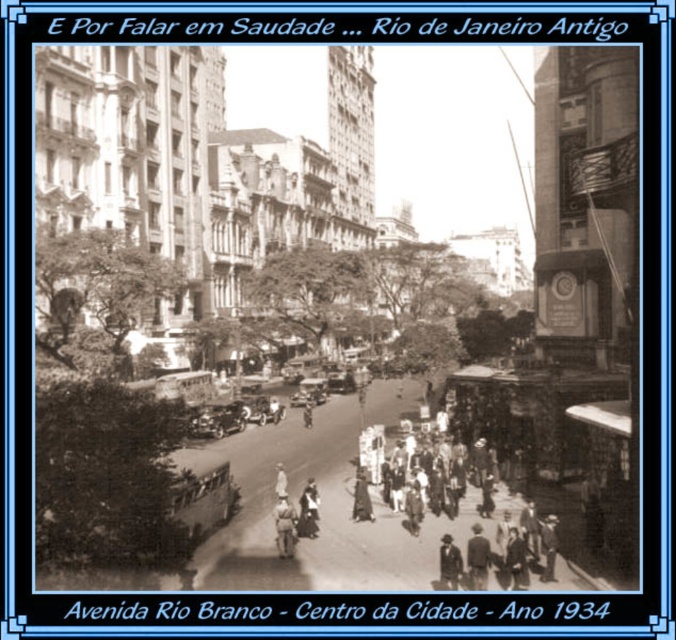
You are a pedestrian standing at point (295, 532) and want to walk to point (479, 545). Given the historical context of the 1934 Rio de Janeiro street layout, will you pass through any obstacles on your way?

Since point (479, 545) is in front of point (295, 532), you will not encounter any obstacles on your path as the street is wide and the path is clear.

You are a photographer standing at the edge of Avenida Rio Branco in 1934. You want to take a photo that includes both the shiny chrome car at center and the light brown leather hat at lower center. Which object should you focus on first if you want both to be in clear focus?

The shiny chrome car at center is bigger than the light brown leather hat at lower center, so you should focus on the shiny chrome car at center first to ensure both are in clear focus.